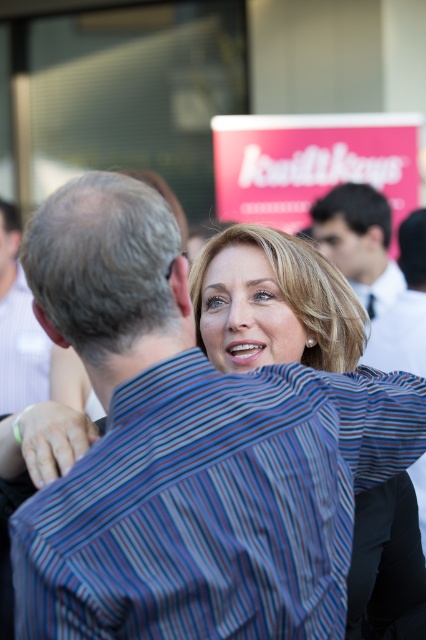
Based on the provided scene description, can you identify which object corresponds to the coordinates point (359, 241)?

The dark blue shirt at upper right is represented by point (359, 241).

Based on the scene description, can you determine if the point labeled as point [46,358] is located behind the other point [385,298]?

Yes, according to the objects description, point [46,358] is behind point [385,298].

Based on the scene description, can you determine the location of the point at coordinates (213, 504)?

The point at coordinates (213, 504) is located on the striped cotton shirt at center.